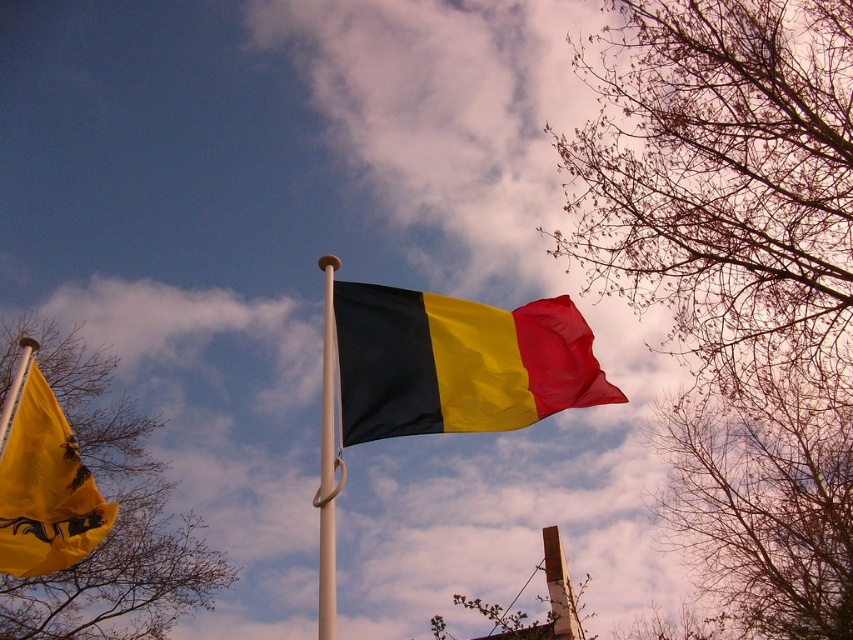
Question: Can you confirm if bare branches at upper right is positioned to the left of white metallic flag pole at center?

Choices:
 (A) yes
 (B) no

Answer: (B)

Question: Is bare branches at left smaller than black matte flag at center?

Choices:
 (A) yes
 (B) no

Answer: (B)

Question: Where is bare branches at left located in relation to black matte flag at center in the image?

Choices:
 (A) left
 (B) right

Answer: (A)

Question: Among these objects, which one is farthest from the camera?

Choices:
 (A) white metallic flag pole at center
 (B) bare branches at upper right
 (C) bare branches at left
 (D) black matte flag at center

Answer: (C)

Question: Which point is closer to the camera?

Choices:
 (A) (637, 296)
 (B) (376, 380)
 (C) (36, 380)
 (D) (323, 461)

Answer: (D)

Question: Considering the real-world distances, which object is farthest from the bare branches at left?

Choices:
 (A) yellow fabric flag at left
 (B) black matte flag at center
 (C) bare branches at upper right

Answer: (B)